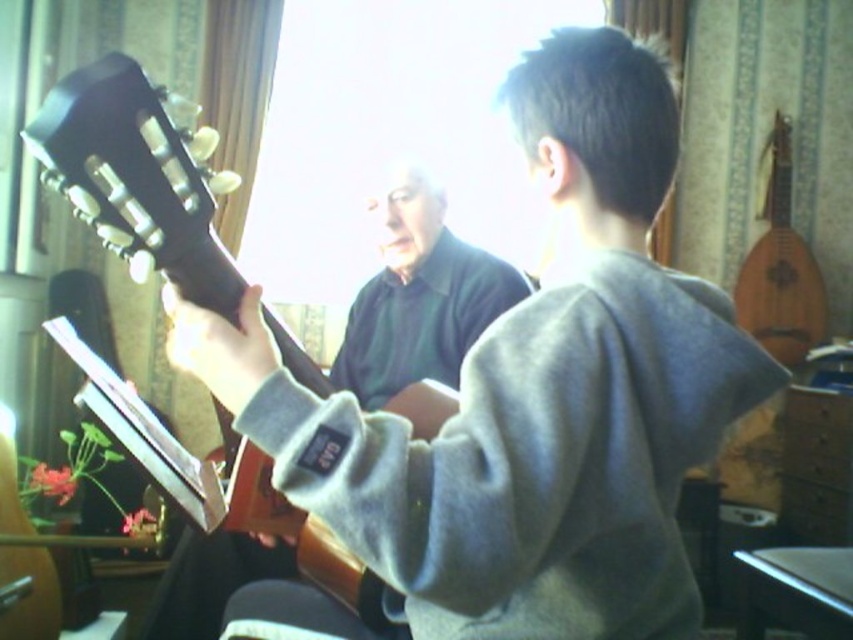
Does gray fleece sweater at center have a larger size compared to dark brown wood guitar at left?

Yes.

Between point (444, 534) and point (207, 246), which one is positioned behind?

The point (207, 246) is more distant.

Which is in front, point (585, 593) or point (190, 211)?

Point (585, 593) is more forward.

This screenshot has height=640, width=853. I want to click on gray fleece sweater at center, so click(521, 401).